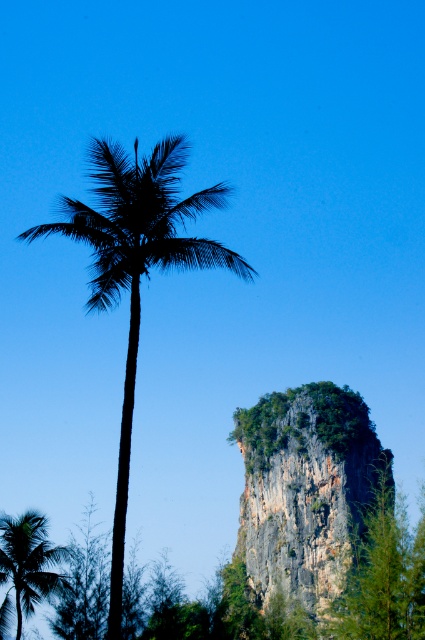
Does rocky cliff at center have a larger size compared to green leafy palm at lower left?

Indeed, rocky cliff at center has a larger size compared to green leafy palm at lower left.

I want to click on rocky cliff at center, so click(x=306, y=490).

Is point (345, 435) in front of point (99, 173)?

No, it is behind (99, 173).

Which is above, rocky cliff at center or black leafy palm at center?

black leafy palm at center

Which is behind, point (337, 433) or point (138, 182)?

The point (337, 433) is more distant.

You are a GUI agent. You are given a task and a screenshot of the screen. Output one action in this format:
    pyautogui.click(x=<x>, y=<y>)
    Task: Click on the rocky cliff at center
    This screenshot has width=425, height=640.
    Given the screenshot: What is the action you would take?
    pyautogui.click(x=306, y=490)

Is point (132, 332) in front of point (6, 563)?

Yes, point (132, 332) is in front of point (6, 563).

Can you confirm if black leafy palm at center is smaller than green leafy palm at lower left?

No, black leafy palm at center is not smaller than green leafy palm at lower left.

Locate an element on the screen. black leafy palm at center is located at coordinates (136, 268).

Identify the location of black leafy palm at center. This screenshot has height=640, width=425. (136, 268).